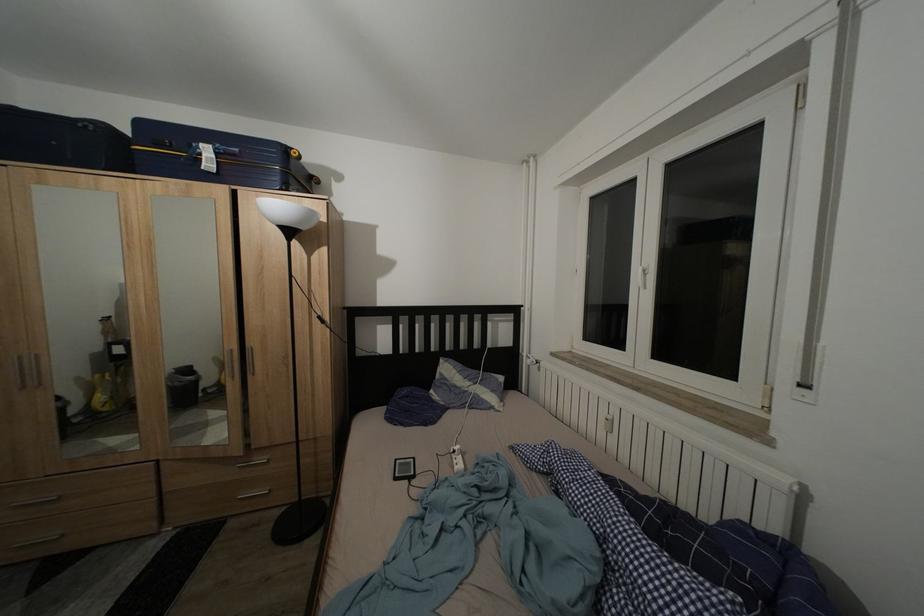
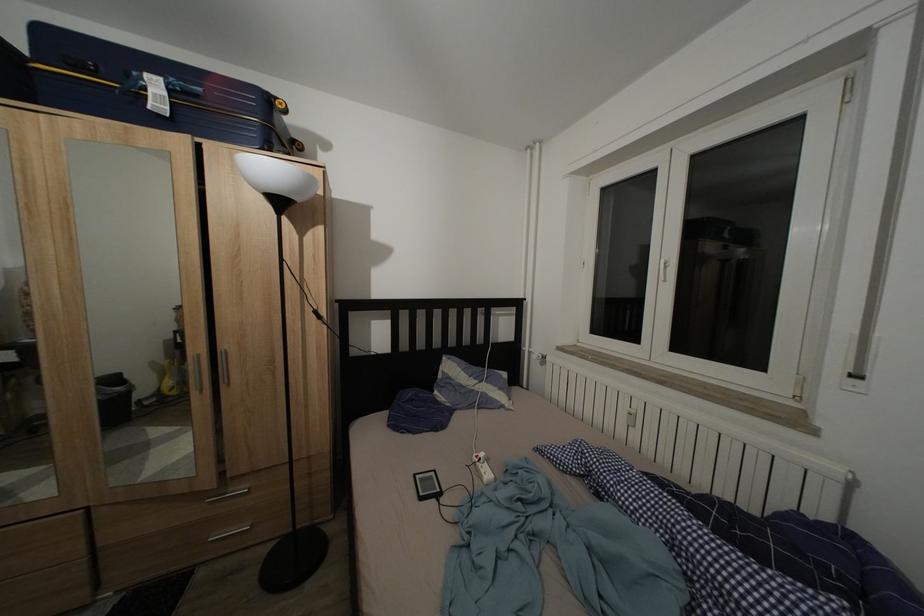
Question: The camera is either moving clockwise (left) or counter-clockwise (right) around the object. The first image is from the beginning of the video and the second image is from the end. Is the camera moving left or right when shooting the video?

Choices:
 (A) Left
 (B) Right

Answer: (A)